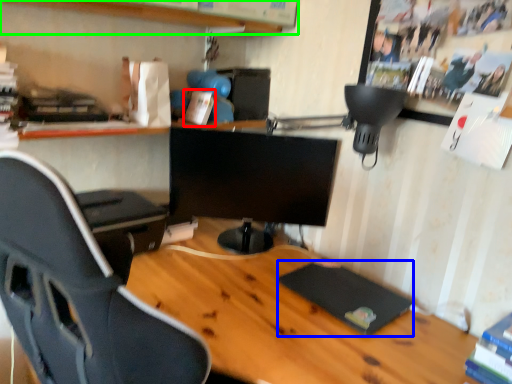
Question: Considering the real-world distances, which object is closest to book (highlighted by a red box)? pad (highlighted by a blue box) or shelf (highlighted by a green box).

Choices:
 (A) pad
 (B) shelf

Answer: (B)